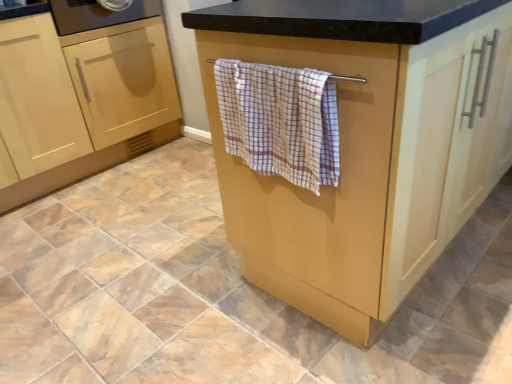
Question: From their relative heights in the image, would you say matte wood towel rack at center, marked as the 3th cabinetry in a left-to-right arrangement, is taller or shorter than light wood cabinet at left, the 2th cabinetry from the right?

Choices:
 (A) tall
 (B) short

Answer: (B)

Question: From the image's perspective, is matte wood towel rack at center, acting as the first cabinetry starting from the right, above or below light wood cabinet at left, the second cabinetry viewed from the left?

Choices:
 (A) above
 (B) below

Answer: (B)

Question: Which object is the farthest from the light wood cabinet at left, the second cabinetry viewed from the left?

Choices:
 (A) light wood cabinet at lower left, arranged as the 3th cabinetry when viewed from the right
 (B) checkered cotton towel at center
 (C) matte wood towel rack at center, marked as the 3th cabinetry in a left-to-right arrangement

Answer: (C)

Question: Which object is positioned farthest from the light wood cabinet at left, the second cabinetry viewed from the left?

Choices:
 (A) checkered cotton towel at center
 (B) matte wood towel rack at center, acting as the first cabinetry starting from the right
 (C) light wood cabinet at lower left, arranged as the 3th cabinetry when viewed from the right

Answer: (B)